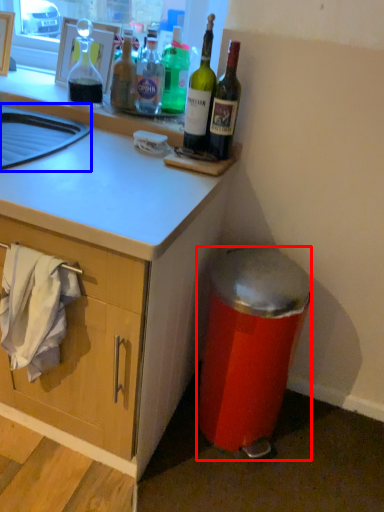
Question: Among these objects, which one is nearest to the camera, trash bin/can (highlighted by a red box) or sink (highlighted by a blue box)?

Choices:
 (A) trash bin/can
 (B) sink

Answer: (B)